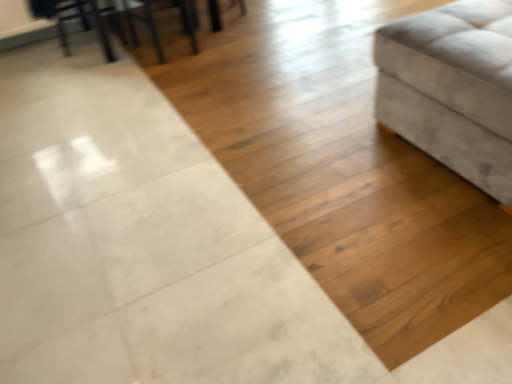
Question: Is metallic silver swivel chair at upper left at the back of metallic black chair at upper left?

Choices:
 (A) no
 (B) yes

Answer: (A)

Question: Is metallic black chair at upper left not inside metallic silver swivel chair at upper left?

Choices:
 (A) no
 (B) yes

Answer: (B)

Question: Considering the relative positions of metallic black chair at upper left and metallic silver swivel chair at upper left in the image provided, is metallic black chair at upper left to the right of metallic silver swivel chair at upper left from the viewer's perspective?

Choices:
 (A) yes
 (B) no

Answer: (A)

Question: Considering the relative sizes of metallic black chair at upper left and metallic silver swivel chair at upper left in the image provided, is metallic black chair at upper left wider than metallic silver swivel chair at upper left?

Choices:
 (A) no
 (B) yes

Answer: (A)

Question: Is metallic black chair at upper left behind metallic silver swivel chair at upper left?

Choices:
 (A) yes
 (B) no

Answer: (B)

Question: Based on their sizes in the image, would you say suede-like beige ottoman at right is bigger or smaller than metallic silver swivel chair at upper left?

Choices:
 (A) small
 (B) big

Answer: (B)

Question: From the image's perspective, is suede-like beige ottoman at right positioned above or below metallic silver swivel chair at upper left?

Choices:
 (A) below
 (B) above

Answer: (A)

Question: Considering the relative positions of suede-like beige ottoman at right and metallic silver swivel chair at upper left in the image provided, is suede-like beige ottoman at right to the left or to the right of metallic silver swivel chair at upper left?

Choices:
 (A) right
 (B) left

Answer: (A)

Question: Looking at their shapes, would you say suede-like beige ottoman at right is wider or thinner than metallic silver swivel chair at upper left?

Choices:
 (A) thin
 (B) wide

Answer: (B)

Question: In terms of width, does wooden table at upper left look wider or thinner when compared to metallic silver swivel chair at upper left?

Choices:
 (A) wide
 (B) thin

Answer: (A)

Question: Does point (86, 26) appear closer or farther from the camera than point (66, 6)?

Choices:
 (A) farther
 (B) closer

Answer: (A)

Question: Is wooden table at upper left situated inside metallic silver swivel chair at upper left or outside?

Choices:
 (A) outside
 (B) inside

Answer: (A)

Question: From the image's perspective, is wooden table at upper left positioned above or below metallic silver swivel chair at upper left?

Choices:
 (A) below
 (B) above

Answer: (B)

Question: From the image's perspective, is metallic silver swivel chair at upper left located above or below metallic black chair at upper left?

Choices:
 (A) below
 (B) above

Answer: (B)

Question: Is point (80, 3) closer or farther from the camera than point (132, 16)?

Choices:
 (A) farther
 (B) closer

Answer: (A)